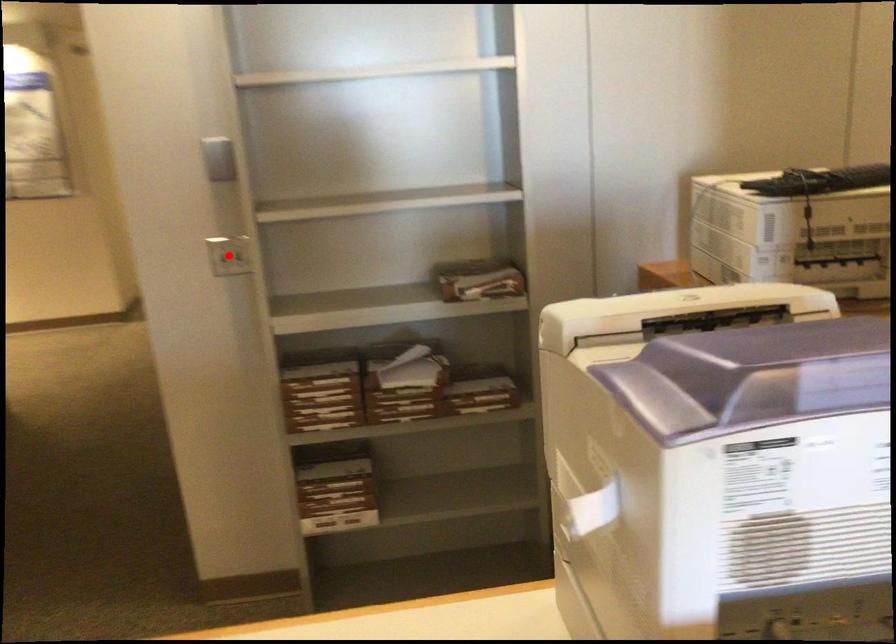
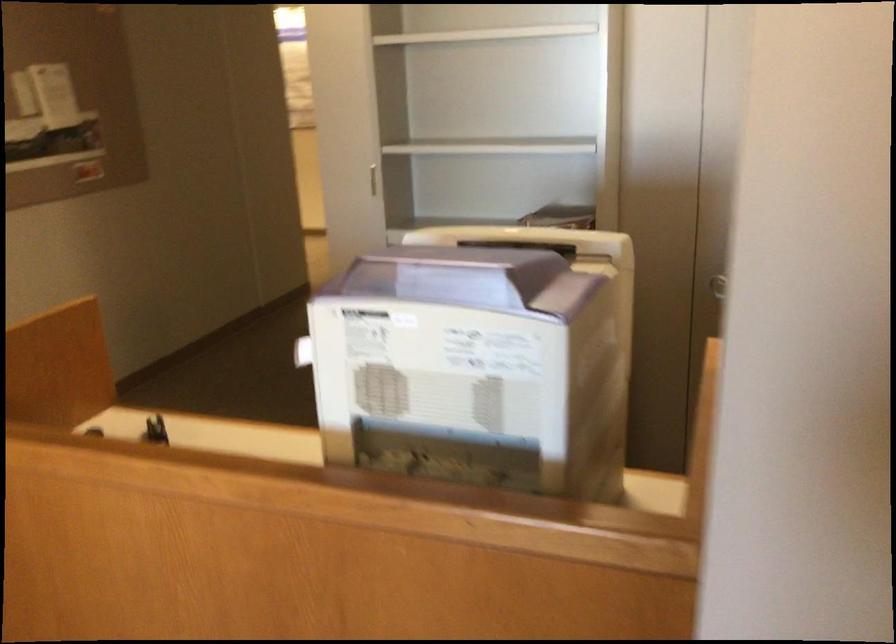
Question: I am providing you with two images of the same scene from different viewpoints. A red point is marked on the first image. Can you still see the location of the red point in image 2?

Choices:
 (A) Yes
 (B) No

Answer: (B)